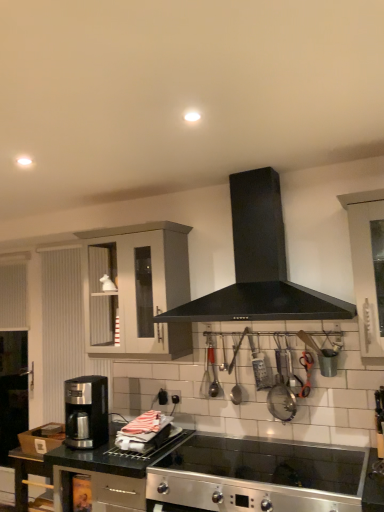
Question: From the image's perspective, is black matte range hood at center above or below matte gray cabinet at upper left?

Choices:
 (A) above
 (B) below

Answer: (A)

Question: Is black matte range hood at center wider or thinner than matte gray cabinet at upper left?

Choices:
 (A) wide
 (B) thin

Answer: (A)

Question: Estimate the real-world distances between objects in this image. Which object is farther from the metallic silver strainer at center-right?

Choices:
 (A) stainless steel cooktop at lower center, which is counted as the 1th countertop, starting from the right
 (B) matte gray cabinet at upper left
 (C) black matte range hood at center
 (D) black granite countertop at lower left, the 1th countertop positioned from the left
 (E) satin black coffee maker at lower left

Answer: (E)

Question: Estimate the real-world distances between objects in this image. Which object is farther from the matte gray cabinet at upper left?

Choices:
 (A) satin black coffee maker at lower left
 (B) black matte range hood at center
 (C) metallic silver strainer at center-right
 (D) black granite countertop at lower left, which ranks as the second countertop in right-to-left order
 (E) stainless steel cooktop at lower center, which is counted as the 1th countertop, starting from the right

Answer: (C)